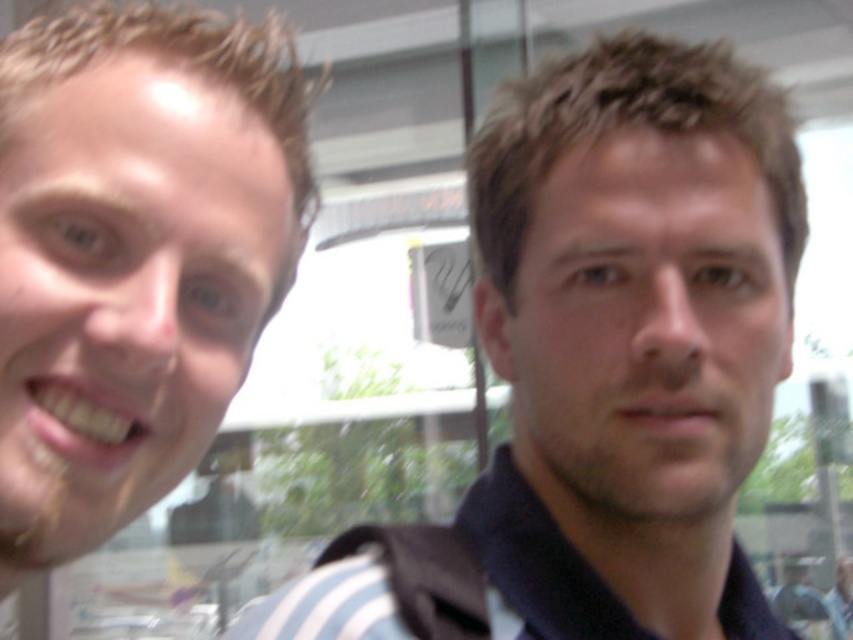
Question: In this image, where is brown hair at right located relative to smooth skin face at left?

Choices:
 (A) right
 (B) left

Answer: (A)

Question: Does brown hair at right have a lesser width compared to smooth skin face at left?

Choices:
 (A) no
 (B) yes

Answer: (A)

Question: Is brown hair at right smaller than smooth skin face at left?

Choices:
 (A) yes
 (B) no

Answer: (B)